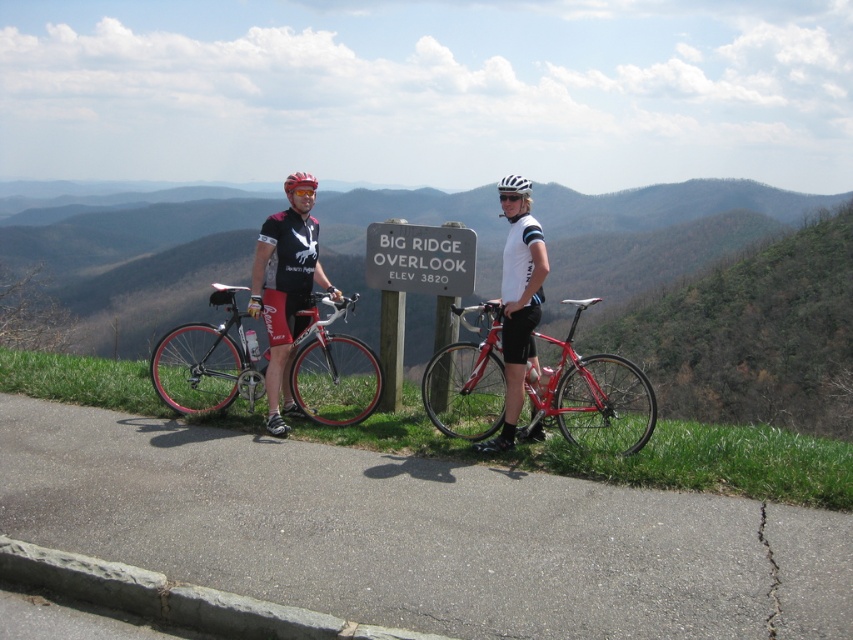
You are standing at the overlook and want to take a photo of both cyclists. The first cyclist is at point (473, 308) and the second cyclist is at point (288, 184). Since you want both in the frame, will you need to adjust your camera angle to include both points?

Point (473, 308) is closer to the viewer than point (288, 184). Therefore, to include both cyclists in the photo, you should adjust your camera angle to account for the depth difference between the two points.

You are a hiker who wants to take a photo of the shiny metallic bicycle at center and the matte black helmet at center from your current position. Which object should you focus on first if you want to capture both in a single shot without moving your camera?

You should focus on the shiny metallic bicycle at center first because it is lower in the frame than the matte black helmet at center, allowing both to be captured in the same shot by adjusting the camera angle slightly downward.